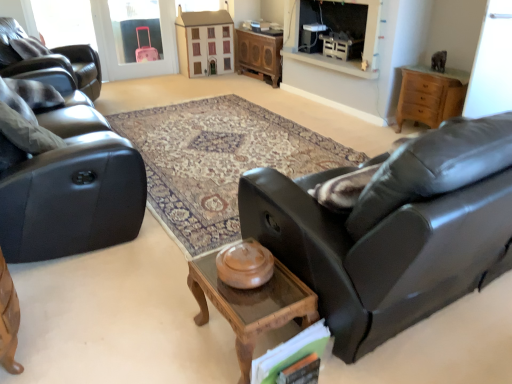
Find the location of `vacant space positioned to the left of wooden glass coffee table at center`. vacant space positioned to the left of wooden glass coffee table at center is located at coordinates (162, 332).